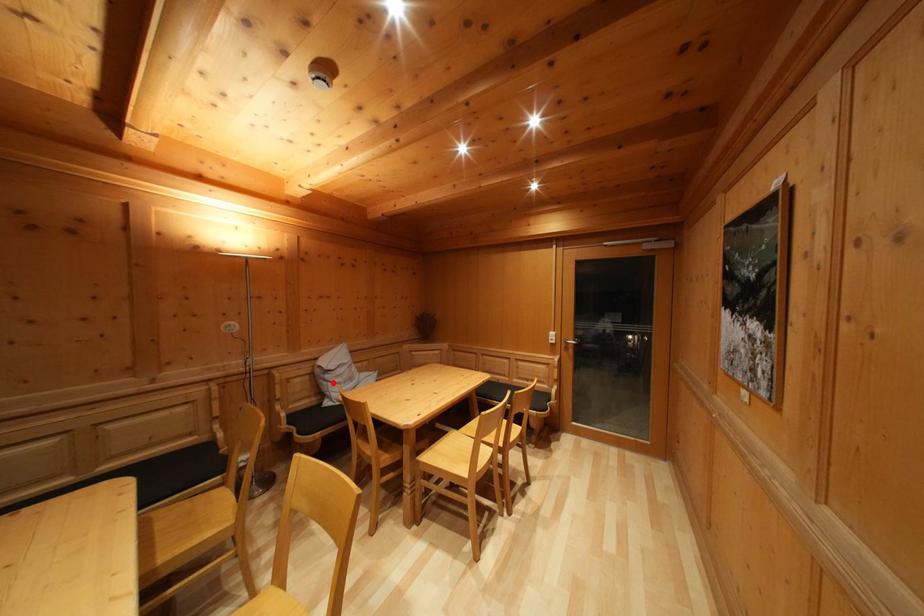
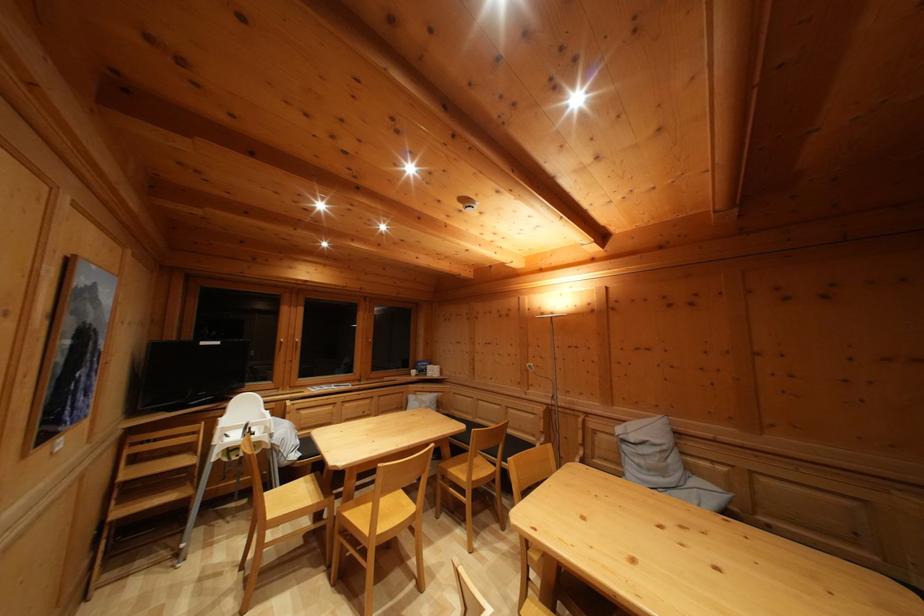
In the second image, find the point that corresponds to the highlighted location in the first image.

(629, 454)